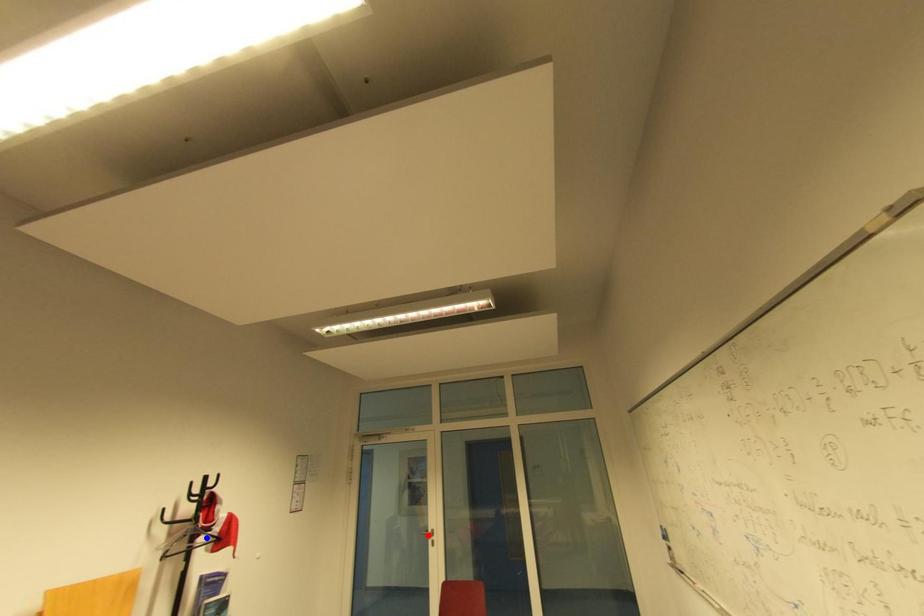
Question: In the image, two points are highlighted. Which point is nearer to the camera? Reply with the corresponding letter.

Choices:
 (A) blue point
 (B) red point

Answer: (A)